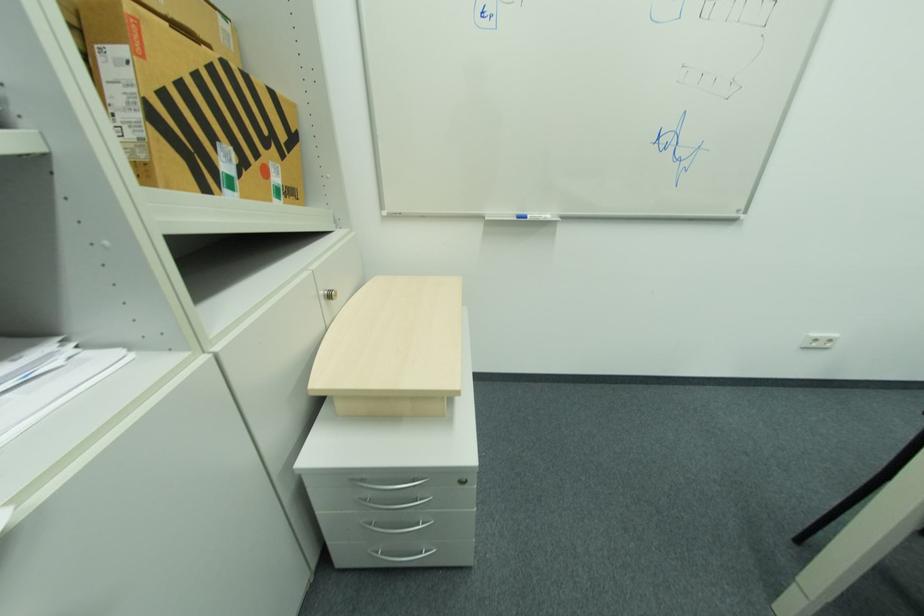
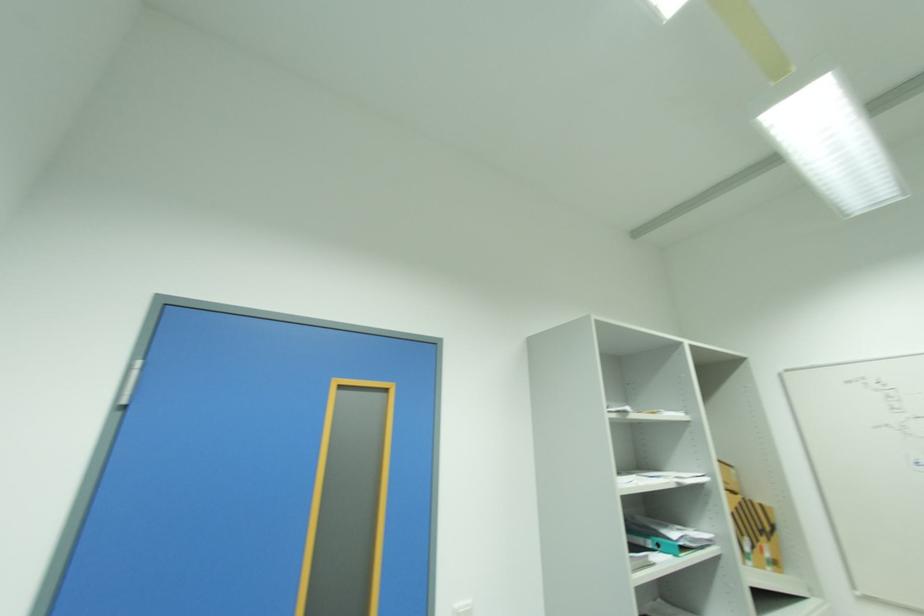
Locate, in the second image, the point that corresponds to the point at 217,71 in the first image.

(746, 506)